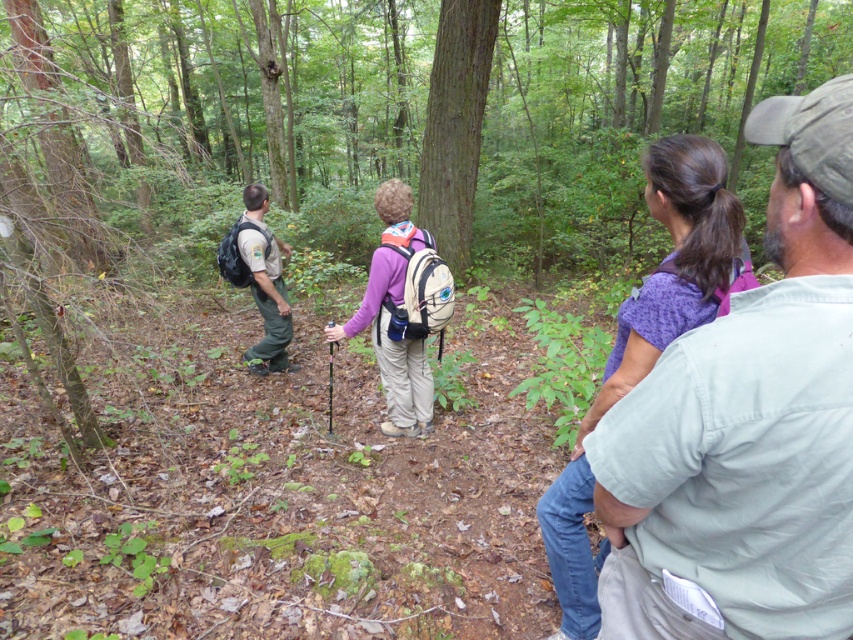
Between point (643, 406) and point (399, 401), which one is positioned behind?

Positioned behind is point (399, 401).

Does gray cotton shirt at upper right appear over purple matte backpack at center?

No, gray cotton shirt at upper right is not above purple matte backpack at center.

You are a GUI agent. You are given a task and a screenshot of the screen. Output one action in this format:
    pyautogui.click(x=<x>, y=<y>)
    Task: Click on the gray cotton shirt at upper right
    The width and height of the screenshot is (853, 640).
    Given the screenshot: What is the action you would take?
    pyautogui.click(x=747, y=426)

Is purple matte backpack at center further to the viewer compared to green uniform at left?

Answer: No, purple matte backpack at center is closer to the viewer.

Which is behind, point (428, 432) or point (260, 205)?

The point (260, 205) is behind.

The width and height of the screenshot is (853, 640). Find the location of `purple matte backpack at center`. purple matte backpack at center is located at coordinates (402, 310).

Can you confirm if gray cotton shirt at upper right is taller than green uniform at left?

No.

Is gray cotton shirt at upper right smaller than green uniform at left?

Yes, gray cotton shirt at upper right is smaller than green uniform at left.

The height and width of the screenshot is (640, 853). In order to click on gray cotton shirt at upper right in this screenshot , I will do `click(747, 426)`.